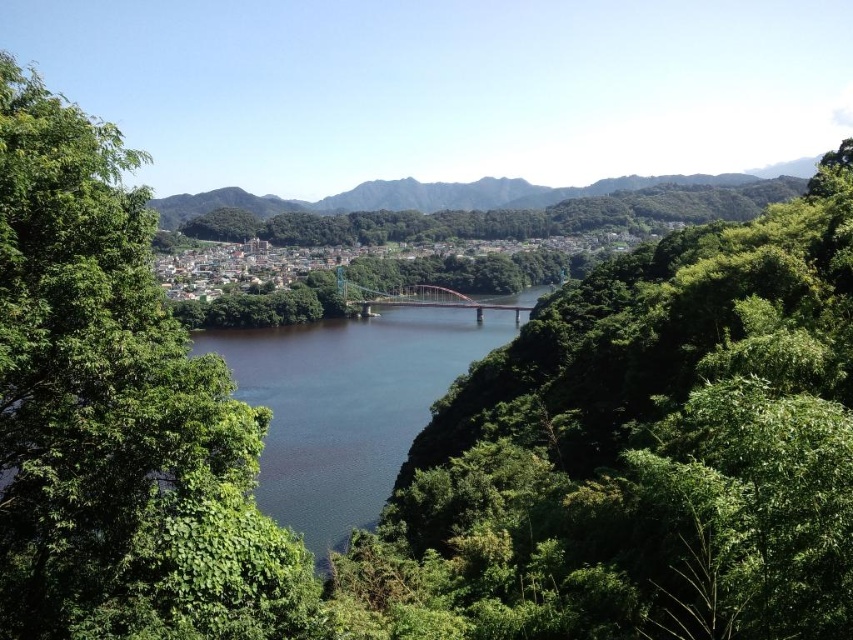
Can you confirm if green leafy tree at left is shorter than dark green water at center?

Yes.

Is green leafy tree at left above dark green water at center?

Yes, green leafy tree at left is above dark green water at center.

Who is more distant from viewer, [106,131] or [425,336]?

Point [425,336]

Where is `green leafy tree at left`? This screenshot has height=640, width=853. green leafy tree at left is located at coordinates (117, 416).

Is point (294, 401) farther from camera compared to point (413, 300)?

No, it is not.

This screenshot has width=853, height=640. What do you see at coordinates (347, 404) in the screenshot?
I see `dark green water at center` at bounding box center [347, 404].

Is point (305, 360) more distant than point (408, 298)?

No, it is in front of (408, 298).

Locate an element on the screen. The width and height of the screenshot is (853, 640). dark green water at center is located at coordinates (347, 404).

Consider the image. Is green leafy tree at center to the right of metallic bridge at center from the viewer's perspective?

Correct, you'll find green leafy tree at center to the right of metallic bridge at center.

Consider the image. Is green leafy tree at center taller than metallic bridge at center?

Yes.

Is point (683, 394) farther from camera compared to point (349, 285)?

No, it is not.

Where is `green leafy tree at center`? The width and height of the screenshot is (853, 640). green leafy tree at center is located at coordinates point(642,452).